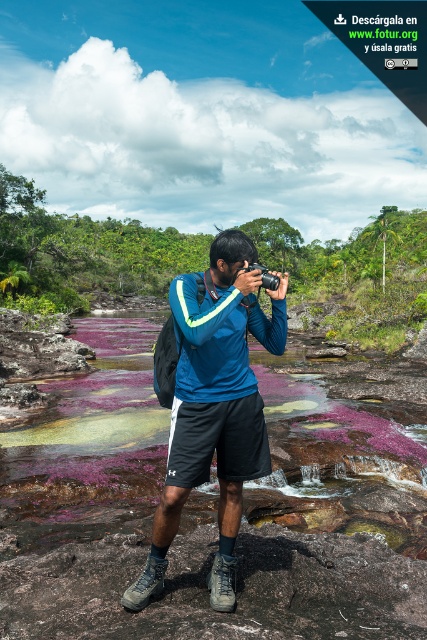
Between point (253, 477) and point (275, 282), which one is positioned in front?

Point (275, 282)

Which of these two, blue fabric shirt at center or black plastic camera at center, stands taller?

With more height is blue fabric shirt at center.

Measure the distance between blue fabric shirt at center and camera.

blue fabric shirt at center and camera are 2.55 meters apart.

Locate an element on the screen. This screenshot has height=640, width=427. blue fabric shirt at center is located at coordinates (215, 406).

Who is shorter, purple mossy rocks at center or blue fabric shirt at center?

Standing shorter between the two is purple mossy rocks at center.

Does purple mossy rocks at center appear on the right side of blue fabric shirt at center?

Incorrect, purple mossy rocks at center is not on the right side of blue fabric shirt at center.

Locate an element on the screen. purple mossy rocks at center is located at coordinates (342, 445).

Can you confirm if purple mossy rocks at center is wider than black plastic camera at center?

Correct, the width of purple mossy rocks at center exceeds that of black plastic camera at center.

Who is more distant from viewer, (313, 524) or (251, 266)?

The point (313, 524) is more distant.

Where is `purple mossy rocks at center`? purple mossy rocks at center is located at coordinates (342, 445).